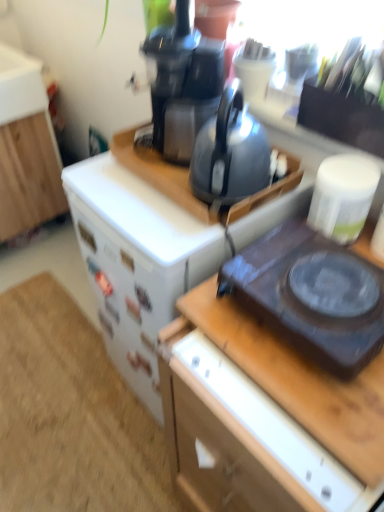
What is the approximate width of white wood cabinet at left?

The width of white wood cabinet at left is 28.90 inches.

At what (x,y) coordinates should I click in order to perform the action: click on wooden desk at center. Please return your answer as a coordinate pair (x, y). Looking at the image, I should click on (264, 416).

What do you see at coordinates (183, 83) in the screenshot? I see `black plastic coffee pot at upper center` at bounding box center [183, 83].

The height and width of the screenshot is (512, 384). I want to click on white wood cabinet at left, so click(26, 148).

Are white wood cabinet at left and matte black kettle at center beside each other?

No, white wood cabinet at left is not with matte black kettle at center.

Is white wood cabinet at left behind matte black kettle at center?

Yes, it is.

Would you say white wood cabinet at left is to the left or to the right of matte black kettle at center in the picture?

Based on their positions, white wood cabinet at left is located to the left of matte black kettle at center.

Image resolution: width=384 pixels, height=512 pixels. Identify the location of kettle lying in front of the white wood cabinet at left. (230, 153).

What's the angular difference between wooden desk at center and black plastic gas stove at right's facing directions?

wooden desk at center and black plastic gas stove at right are facing 1.12 degrees away from each other.

Is wooden desk at center further to camera compared to black plastic gas stove at right?

No, it is not.

From the image's perspective, is wooden desk at center located beneath black plastic gas stove at right?

Yes.

From a real-world perspective, does wooden desk at center sit lower than black plastic gas stove at right?

Correct, in the physical world, wooden desk at center is lower than black plastic gas stove at right.

From the image's perspective, is wooden desk at center above or below white wood cabinet at left?

wooden desk at center is situated lower than white wood cabinet at left in the image.

Would you say wooden desk at center is inside or outside white wood cabinet at left?

wooden desk at center is outside white wood cabinet at left.

Can you see wooden desk at center touching white wood cabinet at left?

No, wooden desk at center is not next to white wood cabinet at left.

Which is more to the right, matte black kettle at center or wooden desk at center?

Positioned to the right is wooden desk at center.

At what (x,y) coordinates should I click in order to perform the action: click on desk to the right of matte black kettle at center. Please return your answer as a coordinate pair (x, y). This screenshot has width=384, height=512. Looking at the image, I should click on (264, 416).

Is the surface of matte black kettle at center in direct contact with wooden desk at center?

No, matte black kettle at center is not in contact with wooden desk at center.

Which of these two, matte black kettle at center or black plastic coffee pot at upper center, stands taller?

With more height is black plastic coffee pot at upper center.

Which object is further away from the camera, matte black kettle at center or black plastic coffee pot at upper center?

black plastic coffee pot at upper center is more distant.

Is matte black kettle at center spatially inside black plastic coffee pot at upper center, or outside of it?

matte black kettle at center cannot be found inside black plastic coffee pot at upper center.

Is matte black kettle at center located within black plastic coffee pot at upper center?

No, matte black kettle at center is not a part of black plastic coffee pot at upper center.

From the image's perspective, is black plastic coffee pot at upper center above matte black kettle at center?

Indeed, from the image's perspective, black plastic coffee pot at upper center is shown above matte black kettle at center.

Are black plastic coffee pot at upper center and matte black kettle at center located far from each other?

black plastic coffee pot at upper center is near matte black kettle at center, not far away.

You are a GUI agent. You are given a task and a screenshot of the screen. Output one action in this format:
    pyautogui.click(x=<x>, y=<y>)
    Task: Click on the coffeepot behind the black plastic gas stove at right
    This screenshot has width=384, height=512.
    Given the screenshot: What is the action you would take?
    pyautogui.click(x=183, y=83)

Are black plastic coffee pot at upper center and black plastic gas stove at right located far from each other?

No, black plastic coffee pot at upper center is not far from black plastic gas stove at right.

Considering the positions of point (197, 100) and point (351, 330), is point (197, 100) closer or farther from the camera than point (351, 330)?

Point (197, 100).

This screenshot has width=384, height=512. I want to click on kettle to the right of white wood cabinet at left, so click(230, 153).

The width and height of the screenshot is (384, 512). In order to click on gas stove above the wooden desk at center (from the image's perspective) in this screenshot , I will do `click(311, 295)`.

Looking at the image, which one is located closer to white wood cabinet at left, wooden desk at center or matte black kettle at center?

Among the two, matte black kettle at center is located nearer to white wood cabinet at left.

From the image, which object appears to be farther from black plastic coffee pot at upper center, matte black kettle at center or white wood cabinet at left?

Based on the image, white wood cabinet at left appears to be further to black plastic coffee pot at upper center.

Considering their positions, is white wood cabinet at left positioned further to wooden desk at center than black plastic coffee pot at upper center?

white wood cabinet at left.

Consider the image. Estimate the real-world distances between objects in this image. Which object is further from wooden desk at center, white wood cabinet at left or matte black kettle at center?

white wood cabinet at left is further to wooden desk at center.

From the image, which object appears to be nearer to black plastic coffee pot at upper center, white wood cabinet at left or matte black kettle at center?

matte black kettle at center is closer to black plastic coffee pot at upper center.

From the image, which object appears to be nearer to white wood cabinet at left, matte black kettle at center or black plastic coffee pot at upper center?

Based on the image, black plastic coffee pot at upper center appears to be nearer to white wood cabinet at left.

When comparing their distances from black plastic gas stove at right, does white wood cabinet at left or wooden desk at center seem closer?

Based on the image, wooden desk at center appears to be nearer to black plastic gas stove at right.

Based on their spatial positions, is black plastic gas stove at right or matte black kettle at center further from wooden desk at center?

matte black kettle at center.

Find the location of `coffeepot between white wood cabinet at left and matte black kettle at center from left to right`. coffeepot between white wood cabinet at left and matte black kettle at center from left to right is located at coordinates (183, 83).

Locate an element on the screen. The height and width of the screenshot is (512, 384). kettle situated between white wood cabinet at left and wooden desk at center from left to right is located at coordinates (230, 153).

The image size is (384, 512). Identify the location of kettle between white wood cabinet at left and black plastic gas stove at right. (230, 153).

Locate an element on the screen. The height and width of the screenshot is (512, 384). kettle between black plastic coffee pot at upper center and black plastic gas stove at right vertically is located at coordinates (x=230, y=153).